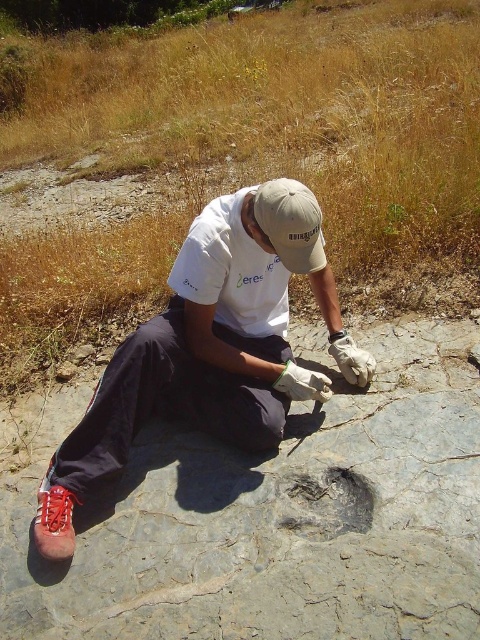
Question: Can you confirm if gray stone fossil at center is positioned above khaki fabric cap at center?

Choices:
 (A) yes
 (B) no

Answer: (B)

Question: Is white cotton shirt at center below dark gray stone fossil at center?

Choices:
 (A) yes
 (B) no

Answer: (B)

Question: Which object is closer to the camera taking this photo?

Choices:
 (A) dark gray stone fossil at center
 (B) white cotton shirt at center

Answer: (B)

Question: Which object is closer to the camera taking this photo?

Choices:
 (A) khaki fabric cap at center
 (B) red leather shoe at lower left
 (C) dark gray stone fossil at center
 (D) gray stone fossil at center

Answer: (D)

Question: Which point is closer to the camera?

Choices:
 (A) khaki fabric cap at center
 (B) dark gray stone fossil at center
 (C) red leather shoe at lower left

Answer: (A)

Question: Considering the relative positions of khaki fabric cap at center and red leather shoe at lower left in the image provided, where is khaki fabric cap at center located with respect to red leather shoe at lower left?

Choices:
 (A) above
 (B) below

Answer: (A)